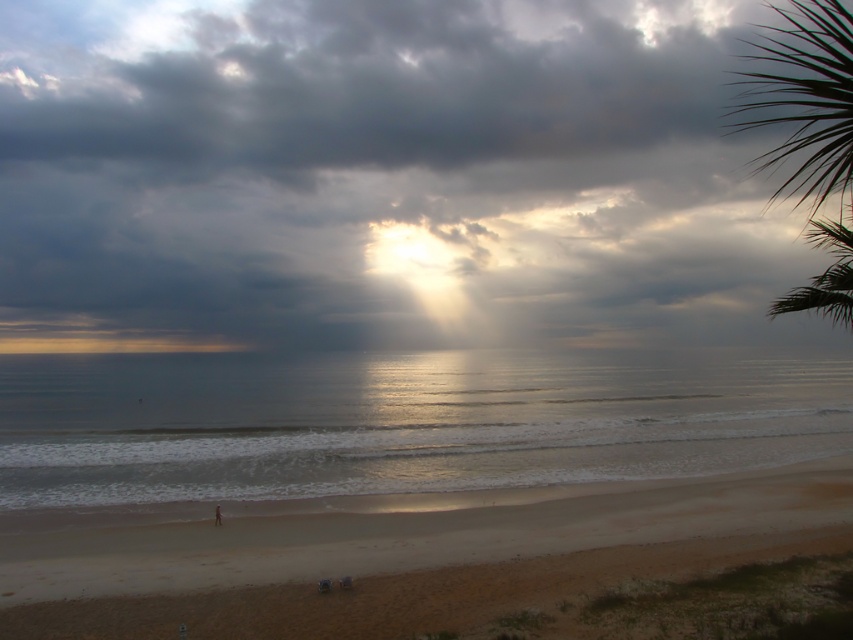
You are a photographer trying to capture the sunset. You notice the dark gray cloud at upper center and the smooth blue water at center. Which object would you focus on if you want to highlight something with a wider visual presence in your photo?

The dark gray cloud at upper center has a larger width than the smooth blue water at center, so focusing on it would better highlight a wider visual presence in your photo.

You are standing on the beach and see two points in the scene. The first point is labeled as point [120,156] and the second is point [273,532]. Which point is closer to you?

Point [120,156] is further to the camera than point [273,532], so the point closer to you is point [273,532].

You are standing on the beach and looking towards the horizon. You see the dark gray cloud at upper center and the smooth blue water at center. Which object is closer to you?

The dark gray cloud at upper center is closer to you because it is in front of the smooth blue water at center.